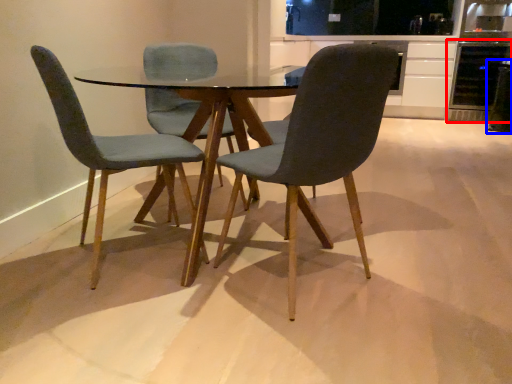
Question: Which point is further to the camera, appliance (highlighted by a red box) or appliance (highlighted by a blue box)?

Choices:
 (A) appliance
 (B) appliance

Answer: (A)